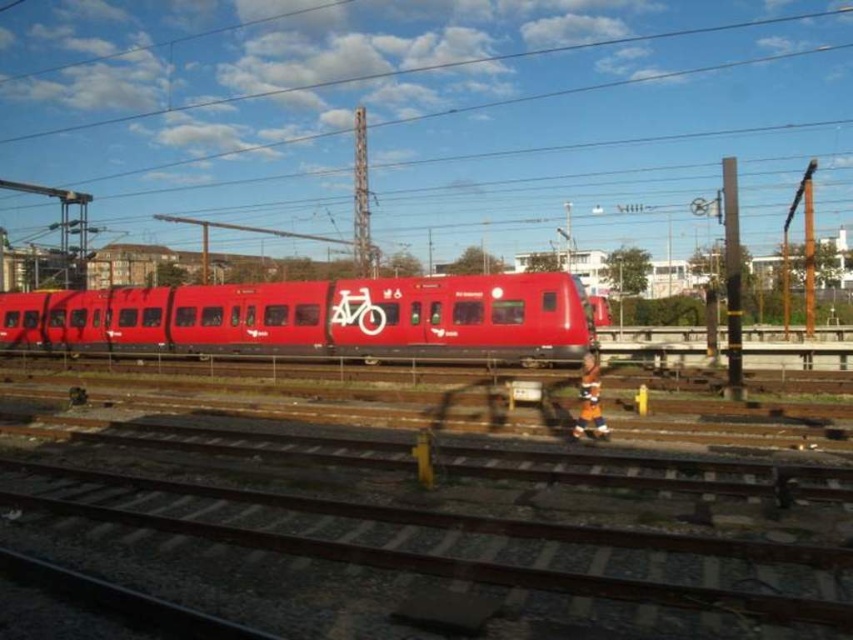
Question: Is the position of brown metallic track at lower center less distant than that of matte red train at center?

Choices:
 (A) yes
 (B) no

Answer: (A)

Question: Among these points, which one is farthest from the camera?

Choices:
 (A) (77, 307)
 (B) (380, 520)

Answer: (A)

Question: Where is brown metallic track at lower center located in relation to matte red train at center in the image?

Choices:
 (A) left
 (B) right

Answer: (B)

Question: Which of the following is the closest to the observer?

Choices:
 (A) brown metallic track at lower center
 (B) matte red train at center

Answer: (A)

Question: Which of the following is the farthest from the observer?

Choices:
 (A) (811, 544)
 (B) (421, 300)

Answer: (B)

Question: Does brown metallic track at lower center have a greater width compared to matte red train at center?

Choices:
 (A) yes
 (B) no

Answer: (B)